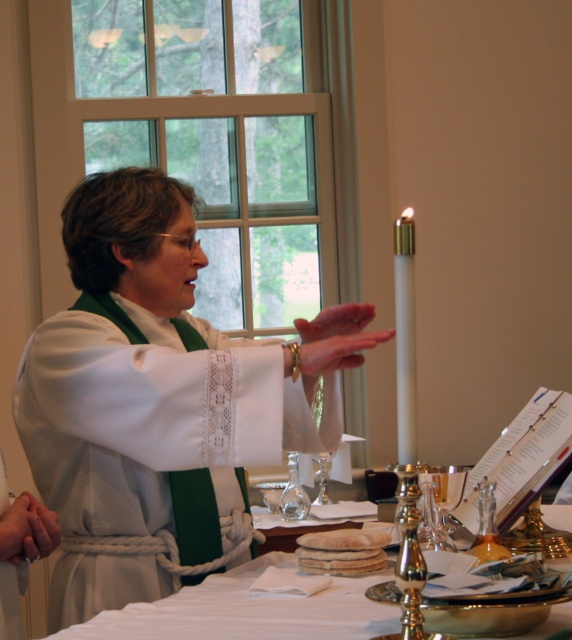
Is the position of white lace fabric at center more distant than that of white cloth at center?

No, it is in front of white cloth at center.

Find the location of a particular element. The image size is (572, 640). white lace fabric at center is located at coordinates (160, 401).

At what (x,y) coordinates should I click in order to perform the action: click on white lace fabric at center. Please return your answer as a coordinate pair (x, y). The height and width of the screenshot is (640, 572). Looking at the image, I should click on point(160,401).

Is transparent glass wine glass at center thinner than clear glass wine glass at center?

Incorrect, transparent glass wine glass at center's width is not less than clear glass wine glass at center's.

Is transparent glass wine glass at center further to the viewer compared to clear glass wine glass at center?

Yes, it is.

Describe the element at coordinates (293, 493) in the screenshot. I see `transparent glass wine glass at center` at that location.

Locate an element on the screen. transparent glass wine glass at center is located at coordinates (293, 493).

Between white lace fabric at center and transparent glass wine glass at center, which one appears on the right side from the viewer's perspective?

transparent glass wine glass at center

Does white lace fabric at center appear under transparent glass wine glass at center?

Actually, white lace fabric at center is above transparent glass wine glass at center.

What do you see at coordinates (160, 401) in the screenshot? The height and width of the screenshot is (640, 572). I see `white lace fabric at center` at bounding box center [160, 401].

The width and height of the screenshot is (572, 640). What are the coordinates of `white lace fabric at center` in the screenshot? It's located at (160, 401).